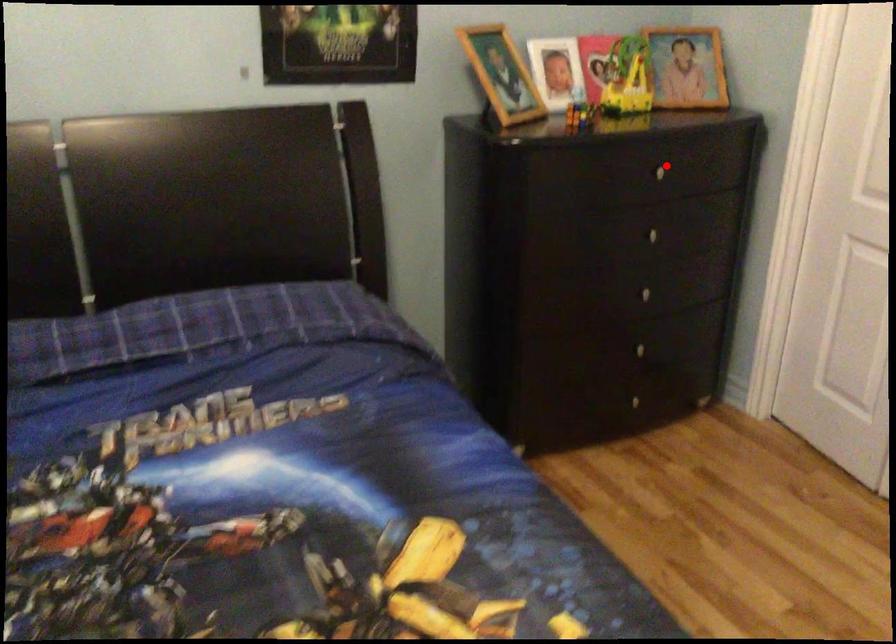
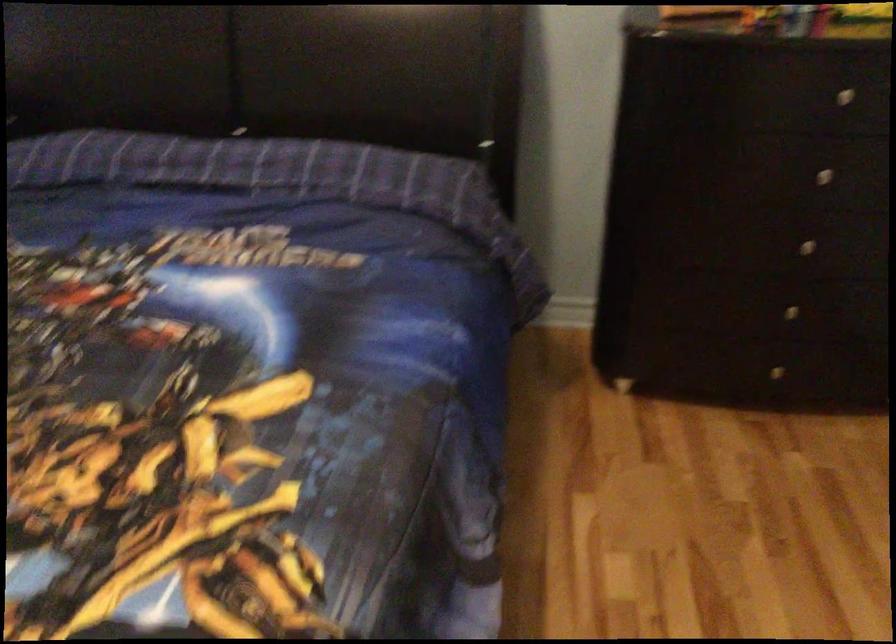
Question: I am providing you with two images of the same scene from different viewpoints. A red point is shown in image1. For the corresponding object point in image2, is it positioned nearer or farther from the camera?

Choices:
 (A) Nearer
 (B) Farther

Answer: (A)